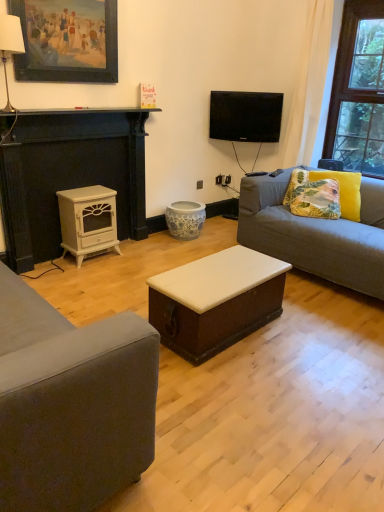
Find the location of `free spot in front of white painted wood stove at left, which is counted as the first table, starting from the back`. free spot in front of white painted wood stove at left, which is counted as the first table, starting from the back is located at coordinates (91, 270).